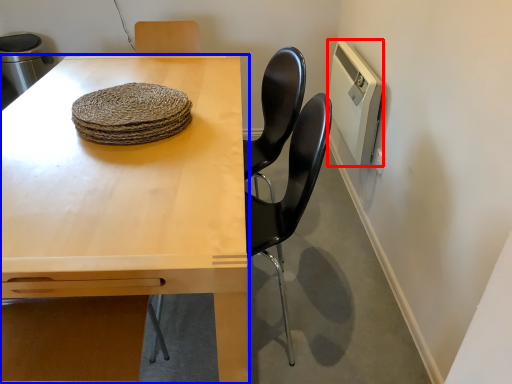
Question: Which point is further to the camera, appliance (highlighted by a red box) or table (highlighted by a blue box)?

Choices:
 (A) appliance
 (B) table

Answer: (A)